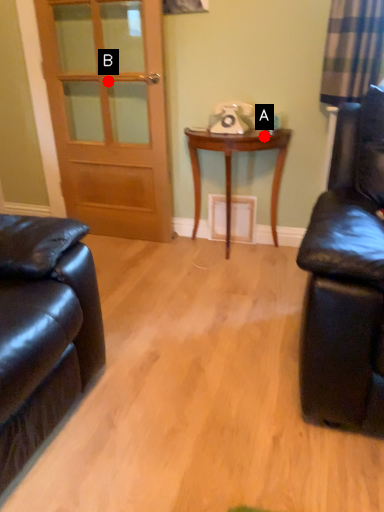
Question: Two points are circled on the image, labeled by A and B beside each circle. Which point is closer to the camera?

Choices:
 (A) A is closer
 (B) B is closer

Answer: (A)